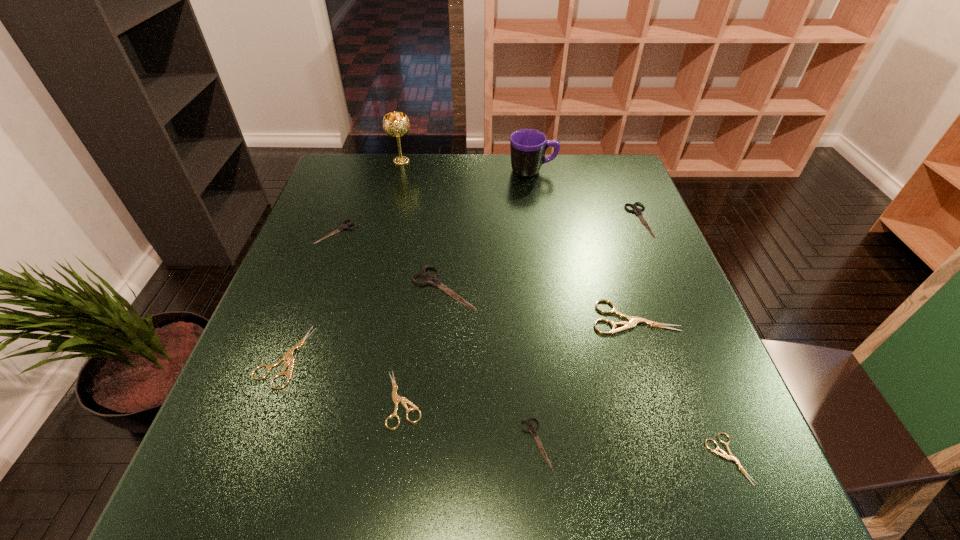
At what (x,y) coordinates should I click in order to perform the action: click on the tallest object. Please return your answer as a coordinate pair (x, y). Image resolution: width=960 pixels, height=540 pixels. Looking at the image, I should click on (395, 124).

This screenshot has width=960, height=540. I want to click on chalice, so click(395, 124).

The height and width of the screenshot is (540, 960). I want to click on mug, so click(528, 146).

Where is `black mug`? Image resolution: width=960 pixels, height=540 pixels. black mug is located at coordinates (528, 146).

Locate an element on the screen. The height and width of the screenshot is (540, 960). the tallest shears is located at coordinates (429, 279).

Find the location of a particular element. Image resolution: width=960 pixels, height=540 pixels. the second nearest black shears is located at coordinates (429, 279).

Find the location of a particular element. The image size is (960, 540). the second biggest black shears is located at coordinates tap(636, 210).

The image size is (960, 540). What are the coordinates of `the biggest beige shears` in the screenshot? It's located at (633, 320).

Where is `the third biggest black shears`? The image size is (960, 540). the third biggest black shears is located at coordinates (343, 226).

Locate an element on the screen. The image size is (960, 540). the third smallest beige shears is located at coordinates (288, 356).